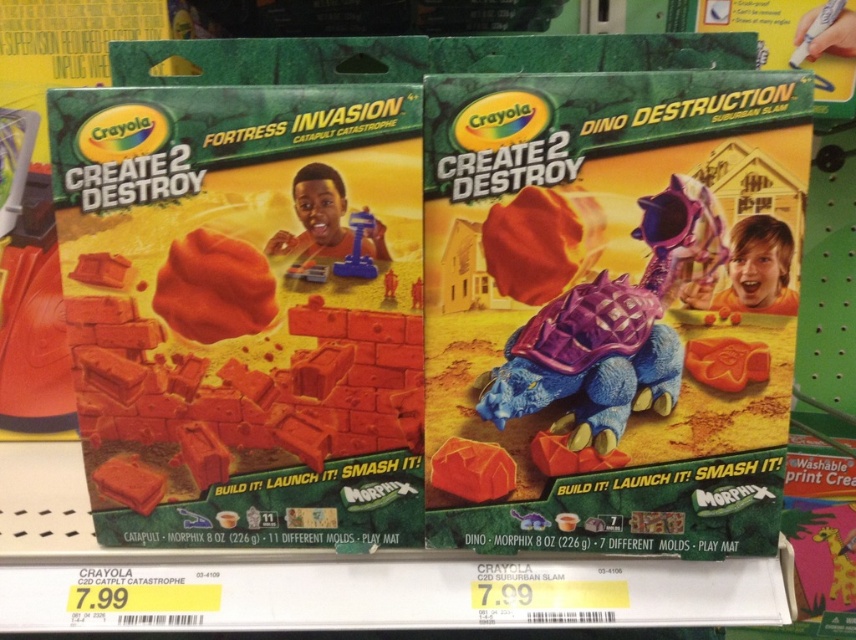
Question: Estimate the real-world distances between objects in this image. Which object is farther from the orange rubber dinosaur at center?

Choices:
 (A) matte orange foam at center
 (B) purple matte dinosaur at center
 (C) matte orange rock at center
 (D) matte plastic catapult at center

Answer: (D)

Question: Observing the image, what is the correct spatial positioning of orange matte rock at center in reference to orange rubber dinosaur at center?

Choices:
 (A) above
 (B) below

Answer: (B)

Question: Does matte orange foam at center appear on the right side of matte orange rock at center?

Choices:
 (A) no
 (B) yes

Answer: (A)

Question: Does matte plastic catapult at center have a lesser width compared to matte orange rock at center?

Choices:
 (A) no
 (B) yes

Answer: (A)

Question: Which point is closer to the camera taking this photo?

Choices:
 (A) (360, 243)
 (B) (712, 344)

Answer: (A)

Question: Which object is the closest to the matte orange rock at center?

Choices:
 (A) orange rubber dinosaur at center
 (B) orange matte rock at center
 (C) purple matte dinosaur at center
 (D) matte plastic catapult at center

Answer: (D)